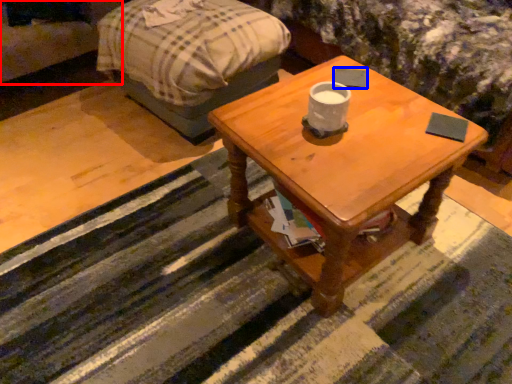
Question: Which point is closer to the camera, couch (highlighted by a red box) or pad (highlighted by a blue box)?

Choices:
 (A) couch
 (B) pad

Answer: (B)